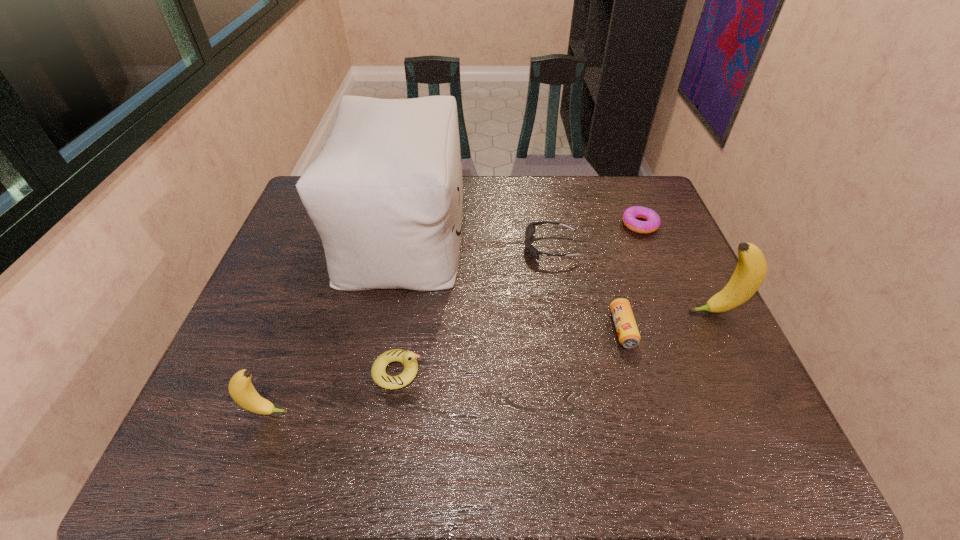
This screenshot has height=540, width=960. Identify the location of vacant region that satisfies the following two spatial constraints: 1. on the back side of the third object from right to left; 2. on the side of the cushion with the smiley face. (595, 233).

Locate an element on the screen. The image size is (960, 540). vacant position in the image that satisfies the following two spatial constraints: 1. on the back side of the fifth object from left to right; 2. on the side of the cushion with the smiley face is located at coordinates tap(595, 233).